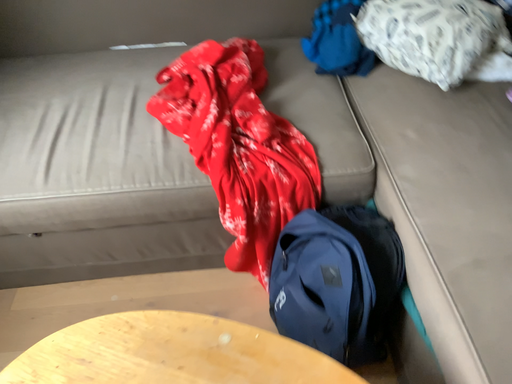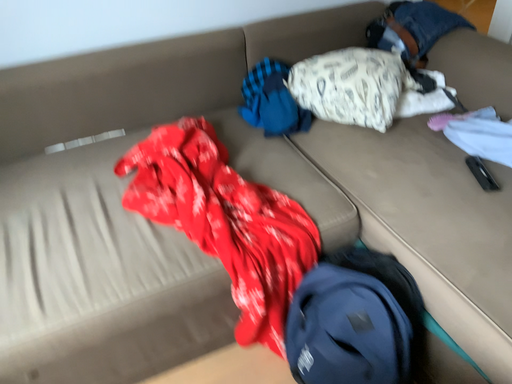
Question: Which way did the camera rotate in the video?

Choices:
 (A) rotated left
 (B) rotated right

Answer: (B)